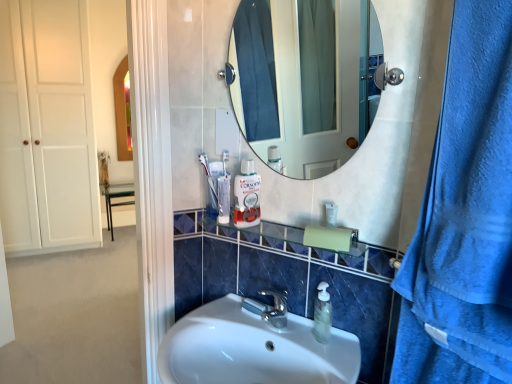
Question: Does point (249, 210) appear closer or farther from the camera than point (377, 248)?

Choices:
 (A) farther
 (B) closer

Answer: (A)

Question: Is white glossy mouthwash at center taller or shorter than clear glass shelf at center?

Choices:
 (A) tall
 (B) short

Answer: (A)

Question: Which of these objects is positioned closest to the blue textured towel at right?

Choices:
 (A) white glossy sink at center
 (B) blue terry cloth towel at right
 (C) white marble mirror at upper center
 (D) white glossy mouthwash at center
 (E) white matte closet door at left

Answer: (B)

Question: Which of these objects is positioned closest to the white marble mirror at upper center?

Choices:
 (A) clear glass shelf at center
 (B) white glossy sink at center
 (C) blue textured towel at right
 (D) white matte closet door at left
 (E) blue terry cloth towel at right

Answer: (A)